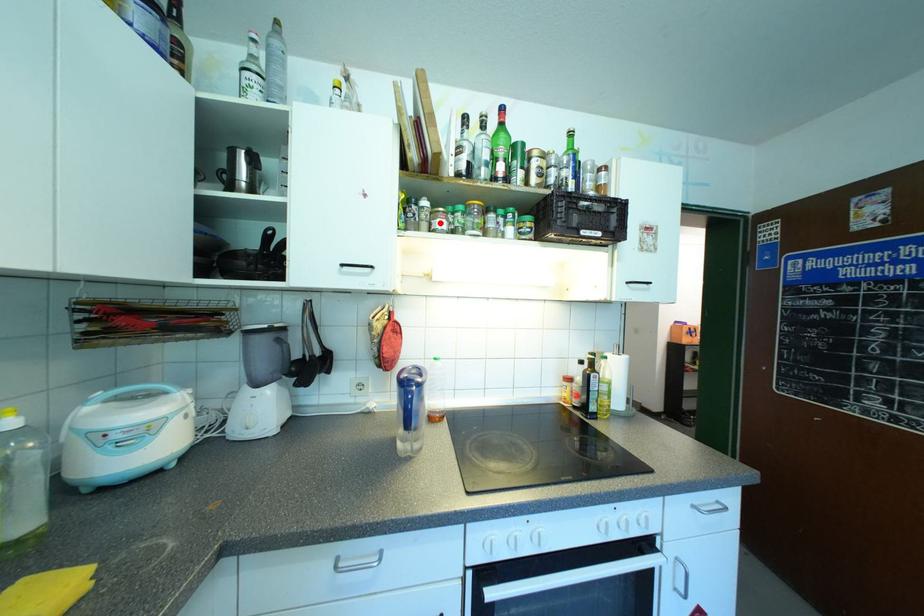
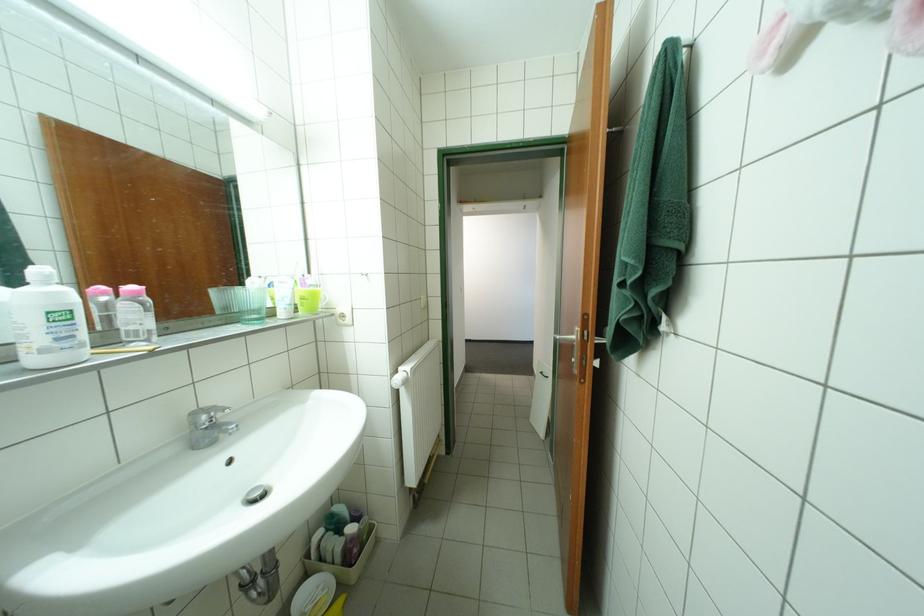
Question: I am providing you with two images of the same scene from different viewpoints. A red point is marked on the first image. Is the red point's position out of view in image 2?

Choices:
 (A) Yes
 (B) No

Answer: (A)